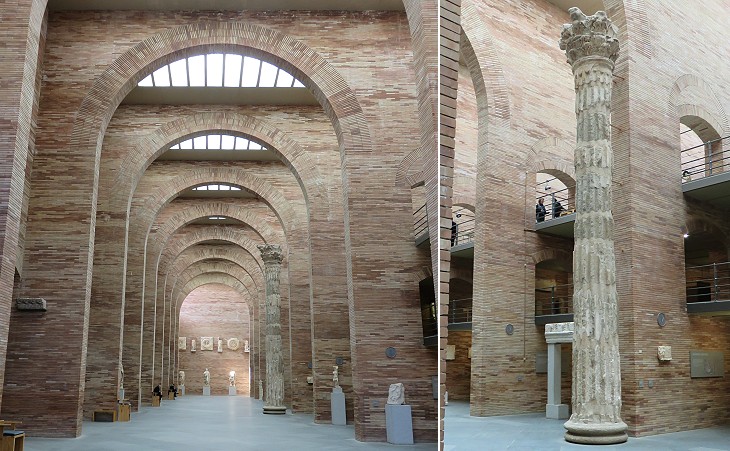
Identify the location of statues side of hallway. (391, 391), (331, 377), (155, 391), (172, 388).